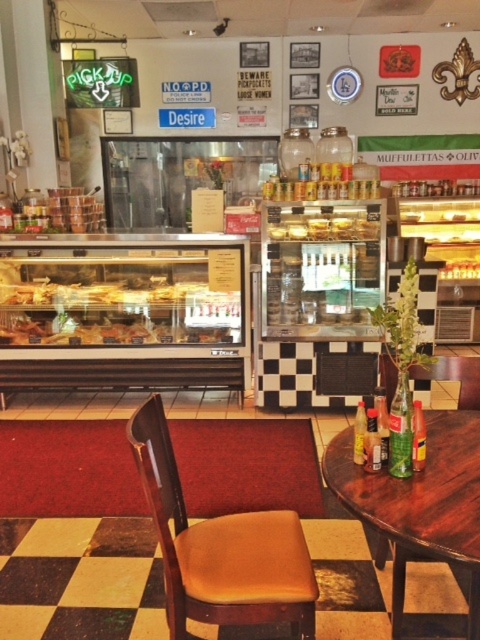
You are a customer entering the eatery and want to sit down. The brown leather chair at center and the wooden table at right are in your path. Considering their widths, which one might you need to maneuver around more carefully?

The wooden table at right has a greater width than the brown leather chair at center, so you would need to maneuver around it more carefully.

You are standing at the entrance of the eatery and want to sit down. Where exactly is the brown leather chair at center located in the image?

The brown leather chair at center is located at point 0.856 on the x axis and 0.460 on the y axis.